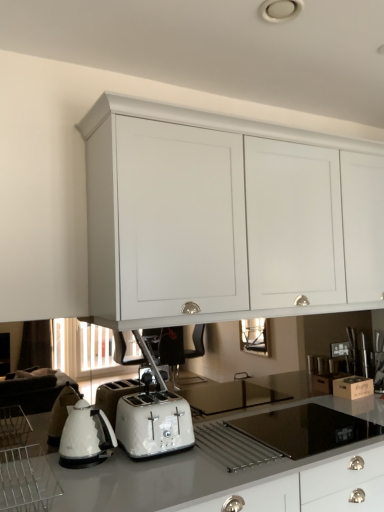
What do you see at coordinates (153, 424) in the screenshot? This screenshot has height=512, width=384. I see `white glossy toaster at lower center` at bounding box center [153, 424].

Image resolution: width=384 pixels, height=512 pixels. I want to click on clear plastic rack at lower left, so click(26, 480).

Identify the location of white matte cabinet at upper center. (225, 217).

The height and width of the screenshot is (512, 384). In order to click on white glossy toaster at lower center in this screenshot , I will do `click(153, 424)`.

Is clear plastic rack at lower left far away from white glossy toaster at lower center?

Actually, clear plastic rack at lower left and white glossy toaster at lower center are a little close together.

From the image's perspective, is clear plastic rack at lower left beneath white glossy toaster at lower center?

Indeed, from the image's perspective, clear plastic rack at lower left is shown beneath white glossy toaster at lower center.

In the scene shown: Considering the relative positions of clear plastic rack at lower left and white glossy toaster at lower center in the image provided, is clear plastic rack at lower left to the left of white glossy toaster at lower center from the viewer's perspective?

Indeed, clear plastic rack at lower left is positioned on the left side of white glossy toaster at lower center.

In terms of height, does clear plastic rack at lower left look taller or shorter compared to white glossy toaster at lower center?

Considering their sizes, clear plastic rack at lower left has less height than white glossy toaster at lower center.

Is black glass gas stove at center not inside white glossy kettle at lower left?

That's correct, black glass gas stove at center is outside of white glossy kettle at lower left.

Considering the sizes of objects black glass gas stove at center and white glossy kettle at lower left in the image provided, who is wider, black glass gas stove at center or white glossy kettle at lower left?

With larger width is black glass gas stove at center.

Are black glass gas stove at center and white glossy kettle at lower left making contact?

No, black glass gas stove at center is not with white glossy kettle at lower left.

From a real-world perspective, who is located lower, black glass gas stove at center or white glossy kettle at lower left?

black glass gas stove at center.

At what (x,y) coordinates should I click in order to perform the action: click on toaster behind the black glass gas stove at center. Please return your answer as a coordinate pair (x, y). Looking at the image, I should click on (153, 424).

Is white glossy toaster at lower center wider than black glass gas stove at center?

No.

Which object is more forward, white glossy toaster at lower center or black glass gas stove at center?

Positioned in front is black glass gas stove at center.

From the picture: Is white glossy kettle at lower left facing towards white matte cabinet at upper center?

No, white glossy kettle at lower left is not turned towards white matte cabinet at upper center.

How far apart are white glossy kettle at lower left and white matte cabinet at upper center?

37.06 inches.

What's the angular difference between white glossy kettle at lower left and white matte cabinet at upper center's facing directions?

1.24 degrees separate the facing orientations of white glossy kettle at lower left and white matte cabinet at upper center.

Based on the photo, from their relative heights in the image, would you say white glossy kettle at lower left is taller or shorter than white matte cabinet at upper center?

white glossy kettle at lower left is shorter than white matte cabinet at upper center.

From a real-world perspective, is white matte cabinet at upper center above or below white glossy countertop at lower center?

white matte cabinet at upper center is situated higher than white glossy countertop at lower center in the real world.

You are a GUI agent. You are given a task and a screenshot of the screen. Output one action in this format:
    pyautogui.click(x=<x>, y=<y>)
    Task: Click on the cabinetry above the white glossy countertop at lower center (from a real-world perspective)
    This screenshot has width=384, height=512.
    Given the screenshot: What is the action you would take?
    [225, 217]

Is white matte cabinet at upper center shorter than white glossy countertop at lower center?

No.

From the image's perspective, between white matte cabinet at upper center and white glossy countertop at lower center, which one is located above?

white matte cabinet at upper center, from the image's perspective.

From a real-world perspective, is white glossy toaster at lower center over white matte cabinet at upper center?

Incorrect, from a real-world perspective, white glossy toaster at lower center is lower than white matte cabinet at upper center.

Is white glossy toaster at lower center taller or shorter than white matte cabinet at upper center?

In the image, white glossy toaster at lower center appears to be shorter than white matte cabinet at upper center.

From the image's perspective, does white glossy toaster at lower center appear lower than white matte cabinet at upper center?

Correct, white glossy toaster at lower center appears lower than white matte cabinet at upper center in the image.

You are a GUI agent. You are given a task and a screenshot of the screen. Output one action in this format:
    pyautogui.click(x=<x>, y=<y>)
    Task: Click on the cabinetry above the white glossy toaster at lower center (from a real-world perspective)
    The height and width of the screenshot is (512, 384).
    Given the screenshot: What is the action you would take?
    pyautogui.click(x=225, y=217)

From the picture: Is white glossy countertop at lower center facing away from clear plastic rack at lower left?

No, white glossy countertop at lower center is not facing the opposite direction of clear plastic rack at lower left.

Considering the positions of point (222, 468) and point (15, 496), is point (222, 468) closer or farther from the camera than point (15, 496)?

Point (222, 468) is farther from the camera than point (15, 496).

From a real-world perspective, is white glossy countertop at lower center on top of clear plastic rack at lower left?

Actually, white glossy countertop at lower center is physically below clear plastic rack at lower left in the real world.

The width and height of the screenshot is (384, 512). Find the location of `kitchen appliance that appears in front of the white glossy toaster at lower center`. kitchen appliance that appears in front of the white glossy toaster at lower center is located at coordinates (26, 480).

At what (x,y) coordinates should I click in order to perform the action: click on gas stove on the right of the white glossy kettle at lower left. Please return your answer as a coordinate pair (x, y). Looking at the image, I should click on (305, 429).

In the scene shown: From the image, which object appears to be farther from white glossy kettle at lower left, white matte cabinet at upper center or white glossy toaster at lower center?

white matte cabinet at upper center is positioned further to the anchor white glossy kettle at lower left.

Considering their positions, is white glossy toaster at lower center positioned further to black glass gas stove at center than white glossy kettle at lower left?

white glossy kettle at lower left is positioned further to the anchor black glass gas stove at center.

Which object lies nearer to the anchor point white matte cabinet at upper center, black glass gas stove at center or clear plastic rack at lower left?

black glass gas stove at center lies closer to white matte cabinet at upper center than the other object.

Which object lies nearer to the anchor point black glass gas stove at center, white matte cabinet at upper center or white glossy toaster at lower center?

white glossy toaster at lower center.

Looking at the image, which one is located further to black glass gas stove at center, white glossy kettle at lower left or white glossy toaster at lower center?

white glossy kettle at lower left is further to black glass gas stove at center.

Estimate the real-world distances between objects in this image. Which object is further from white glossy countertop at lower center, black glass gas stove at center or white glossy kettle at lower left?

white glossy kettle at lower left lies further to white glossy countertop at lower center than the other object.

When comparing their distances from white glossy kettle at lower left, does white matte cabinet at upper center or black glass gas stove at center seem closer?

Among the two, black glass gas stove at center is located nearer to white glossy kettle at lower left.

When comparing their distances from black glass gas stove at center, does white glossy kettle at lower left or white matte cabinet at upper center seem closer?

white glossy kettle at lower left.

Locate an element on the screen. This screenshot has height=512, width=384. home appliance situated between clear plastic rack at lower left and white glossy toaster at lower center from left to right is located at coordinates (86, 436).

Identify the location of toaster that lies between white matte cabinet at upper center and black glass gas stove at center from top to bottom. Image resolution: width=384 pixels, height=512 pixels. (153, 424).

I want to click on gas stove between clear plastic rack at lower left and white matte cabinet at upper center in the horizontal direction, so click(x=305, y=429).

You are a GUI agent. You are given a task and a screenshot of the screen. Output one action in this format:
    pyautogui.click(x=<x>, y=<y>)
    Task: Click on the gas stove between white matte cabinet at upper center and white glossy countertop at lower center vertically
    This screenshot has width=384, height=512.
    Given the screenshot: What is the action you would take?
    pyautogui.click(x=305, y=429)